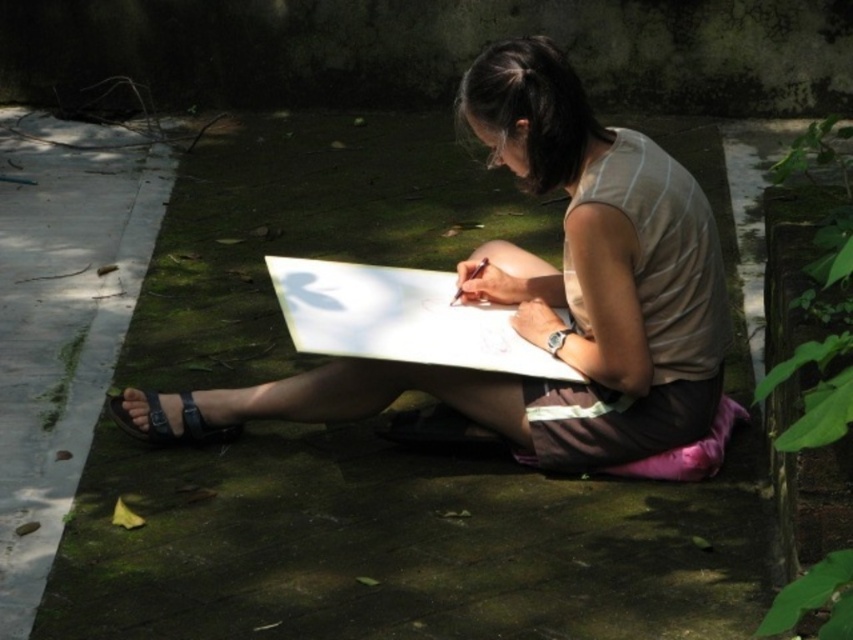
Is matte white paper at center bigger than black leather sandal at lower left?

Correct, matte white paper at center is larger in size than black leather sandal at lower left.

Which is in front, point (473, 419) or point (129, 420)?

Positioned in front is point (473, 419).

I want to click on matte white paper at center, so click(x=556, y=292).

The image size is (853, 640). What are the coordinates of `matte white paper at center` in the screenshot? It's located at (556, 292).